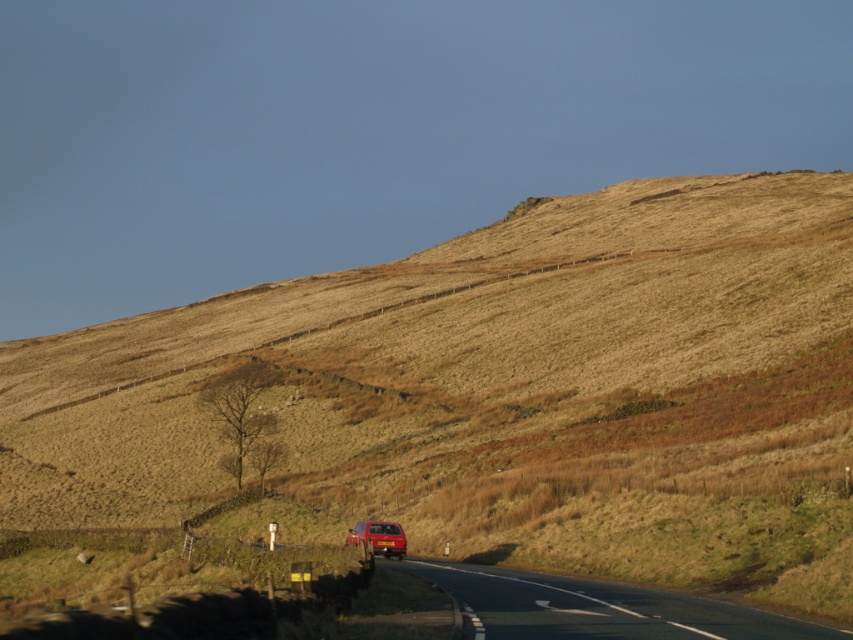
You are driving a car and want to know which point is closer to you as you look at the road ahead. Which point, point (x=642, y=598) or point (x=349, y=529), is closer to your current position?

Point (x=642, y=598) is closer to the camera than point (x=349, y=529), so it is closer to your current position.